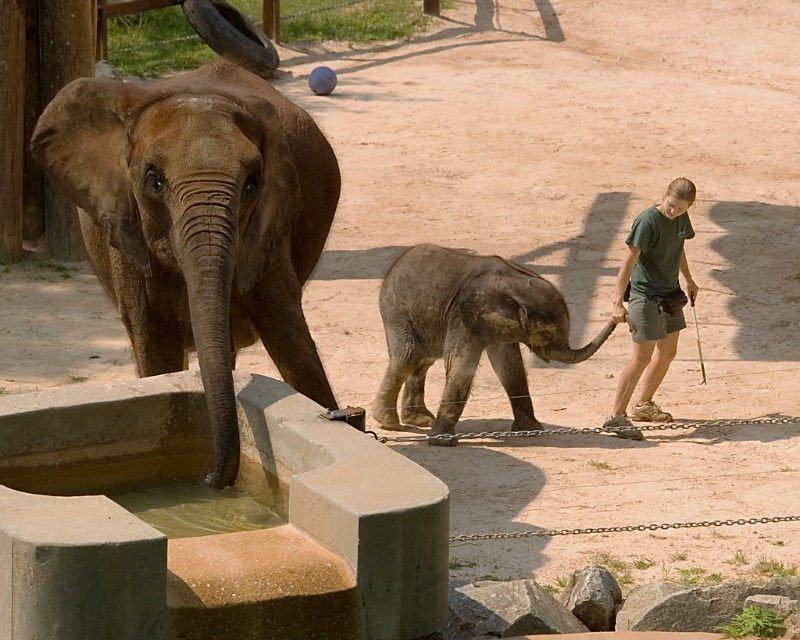
Question: Is brown textured elephant at left bigger than greenish murky water at elephant front?

Choices:
 (A) yes
 (B) no

Answer: (A)

Question: Considering the relative positions of brown textured elephant at left and green fabric shorts at right in the image provided, where is brown textured elephant at left located with respect to green fabric shorts at right?

Choices:
 (A) below
 (B) above

Answer: (B)

Question: Can you confirm if green fabric shorts at right is positioned to the left of greenish murky water at elephant front?

Choices:
 (A) yes
 (B) no

Answer: (B)

Question: Considering the real-world distances, which object is closest to the greenish murky water at elephant front?

Choices:
 (A) brown textured elephant at left
 (B) gray textured baby elephant at center

Answer: (A)

Question: Which object is closer to the camera taking this photo?

Choices:
 (A) greenish murky water at elephant front
 (B) gray textured baby elephant at center
 (C) brown textured elephant at left

Answer: (A)

Question: Among these objects, which one is nearest to the camera?

Choices:
 (A) green fabric shorts at right
 (B) greenish murky water at elephant front
 (C) brown textured elephant at left

Answer: (B)